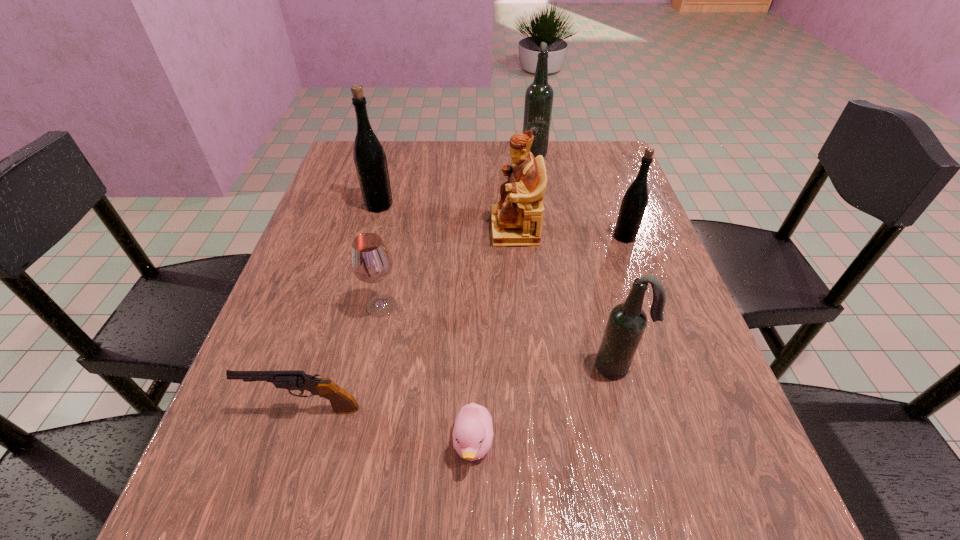
Locate which object is the third closest to the wineglass. Please provide its 2D coordinates. Your answer should be formatted as a tuple, i.e. [(x, y)], where the tuple contains the x and y coordinates of a point satisfying the conditions above.

[(516, 220)]

At what (x,y) coordinates should I click in order to perform the action: click on the second closest object to the black gun. Please return your answer as a coordinate pair (x, y). The width and height of the screenshot is (960, 540). Looking at the image, I should click on (371, 261).

In order to click on beer bottle that is the fourth closest one to the figurine in this screenshot , I will do `click(627, 321)`.

At what (x,y) coordinates should I click in order to perform the action: click on beer bottle that stands as the closest to the second object from right to left. Please return your answer as a coordinate pair (x, y). This screenshot has width=960, height=540. Looking at the image, I should click on (634, 203).

The width and height of the screenshot is (960, 540). What are the coordinates of `vacant region that satisfies the following two spatial constraints: 1. on the back side of the second object from right to left; 2. on the front-facing side of the figurine` in the screenshot? It's located at (582, 230).

Where is `free space that satisfies the following two spatial constraints: 1. along the barrel of the seventh tallest object; 2. on the back side of the fifth farthest object`? Image resolution: width=960 pixels, height=540 pixels. free space that satisfies the following two spatial constraints: 1. along the barrel of the seventh tallest object; 2. on the back side of the fifth farthest object is located at coordinates coord(336,306).

The width and height of the screenshot is (960, 540). In order to click on vacant point that satisfies the following two spatial constraints: 1. along the barrel of the seventh tallest object; 2. on the left side of the rightmost beer bottle in this screenshot , I will do `click(357, 237)`.

You are a GUI agent. You are given a task and a screenshot of the screen. Output one action in this format:
    pyautogui.click(x=<x>, y=<y>)
    Task: Click on the free point that satisfies the following two spatial constraints: 1. along the barrel of the seventh object from left to right; 2. on the right side of the black gun
    Image resolution: width=960 pixels, height=540 pixels.
    Given the screenshot: What is the action you would take?
    pyautogui.click(x=318, y=367)

At what (x,y) coordinates should I click in order to perform the action: click on free space that satisfies the following two spatial constraints: 1. on the front-facing side of the figurine; 2. on the left side of the third farthest beer bottle. Please return your answer as a coordinate pair (x, y). Looking at the image, I should click on (516, 237).

The image size is (960, 540). What are the coordinates of `vacant space that satisfies the following two spatial constraints: 1. along the barrel of the nearer dark beer bottle; 2. on the right side of the gun` in the screenshot? It's located at (318, 367).